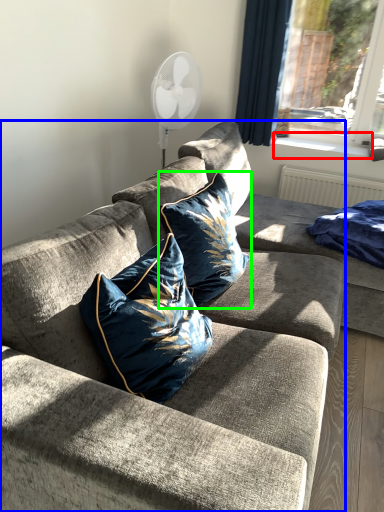
Question: Which object is the closest to the window sill (highlighted by a red box)? Choose among these: studio couch (highlighted by a blue box) or pillow (highlighted by a green box).

Choices:
 (A) studio couch
 (B) pillow

Answer: (B)